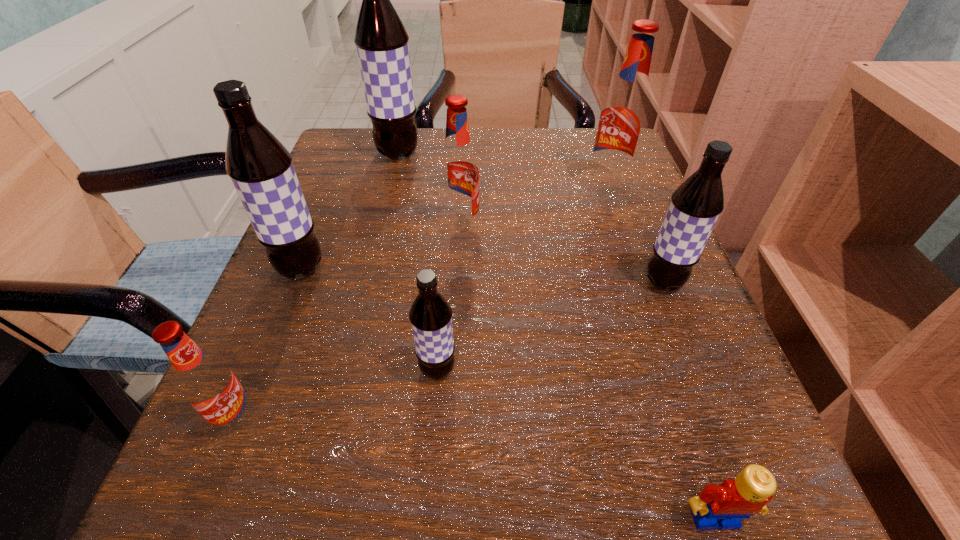
Identify the location of vacant space located on the right of the third brown root beer from left to right. (696, 370).

You are a GUI agent. You are given a task and a screenshot of the screen. Output one action in this format:
    pyautogui.click(x=<x>, y=<y>)
    Task: Click on the object that is at the near edge
    The width and height of the screenshot is (960, 540).
    Given the screenshot: What is the action you would take?
    pyautogui.click(x=724, y=506)

Find the location of a particular element. This screenshot has width=960, height=540. Lego situated at the right edge is located at coordinates (724, 506).

Image resolution: width=960 pixels, height=540 pixels. I want to click on object positioned at the far left corner, so click(x=381, y=40).

Find the location of a particular element. object positioned at the far right corner is located at coordinates (623, 119).

The image size is (960, 540). What are the coordinates of `object present at the near right corner` in the screenshot? It's located at (724, 506).

Where is `free location at the far edge`? The image size is (960, 540). free location at the far edge is located at coordinates (530, 136).

The width and height of the screenshot is (960, 540). In order to click on free spot at the near edge of the desktop in this screenshot , I will do `click(332, 535)`.

In the image, there is a desktop. Where is `free region at the left edge`? free region at the left edge is located at coordinates (309, 368).

I want to click on blank space at the right edge, so 638,282.